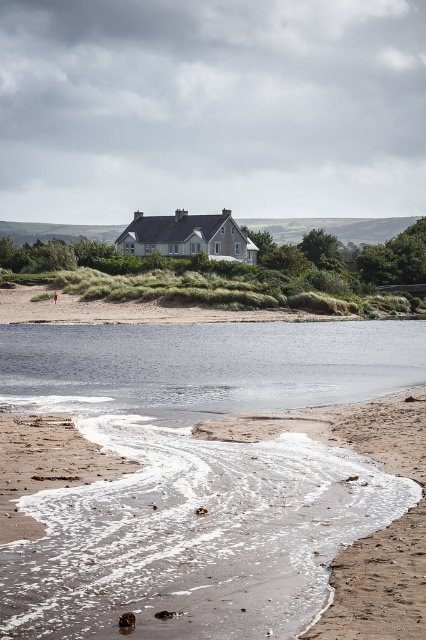
Question: Does sandy beach at lower left appear over clear water at center?

Choices:
 (A) yes
 (B) no

Answer: (B)

Question: Is sandy beach at lower left positioned behind clear water at center?

Choices:
 (A) yes
 (B) no

Answer: (B)

Question: Can you confirm if sandy beach at lower left is positioned to the left of clear water at center?

Choices:
 (A) yes
 (B) no

Answer: (B)

Question: Which of the following is the closest to the observer?

Choices:
 (A) clear water at center
 (B) sandy beach at lower left

Answer: (B)